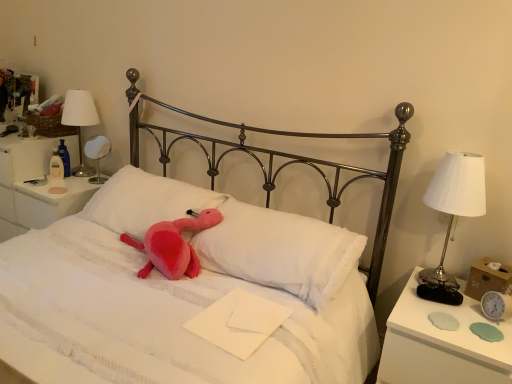
Question: Is silver metallic clock at right turned away from white soft pillow at center, the 2th pillow from the left?

Choices:
 (A) yes
 (B) no

Answer: (B)

Question: From a real-world perspective, is silver metallic clock at right on top of white soft pillow at center, acting as the first pillow starting from the right?

Choices:
 (A) no
 (B) yes

Answer: (A)

Question: Is silver metallic clock at right to the right of white soft pillow at center, the 2th pillow from the left, from the viewer's perspective?

Choices:
 (A) no
 (B) yes

Answer: (B)

Question: From a real-world perspective, is silver metallic clock at right below white soft pillow at center, the 2th pillow from the left?

Choices:
 (A) no
 (B) yes

Answer: (B)

Question: Considering the relative sizes of silver metallic clock at right and white soft pillow at center, acting as the first pillow starting from the right, in the image provided, is silver metallic clock at right wider than white soft pillow at center, acting as the first pillow starting from the right,?

Choices:
 (A) yes
 (B) no

Answer: (B)

Question: From a real-world perspective, is fluffy pink pillow at center, which is the 1th pillow from left to right, above or below pink plush toy at center?

Choices:
 (A) below
 (B) above

Answer: (B)

Question: Is fluffy pink pillow at center, the second pillow from the right, in front of or behind pink plush toy at center in the image?

Choices:
 (A) behind
 (B) front

Answer: (A)

Question: From the image's perspective, relative to pink plush toy at center, is fluffy pink pillow at center, the second pillow from the right, above or below?

Choices:
 (A) above
 (B) below

Answer: (A)

Question: Would you say fluffy pink pillow at center, the second pillow from the right, is to the left or to the right of pink plush toy at center in the picture?

Choices:
 (A) left
 (B) right

Answer: (A)

Question: Does point (196, 304) appear closer or farther from the camera than point (80, 168)?

Choices:
 (A) farther
 (B) closer

Answer: (B)

Question: In the image, is pink plush toy at center positioned in front of or behind white fabric lampshade at upper left, the 3th bedside lamp from the right?

Choices:
 (A) front
 (B) behind

Answer: (A)

Question: Based on their positions, is pink plush toy at center located to the left or right of white fabric lampshade at upper left, the 3th bedside lamp from the right?

Choices:
 (A) right
 (B) left

Answer: (A)

Question: From the image's perspective, is pink plush toy at center located above or below white fabric lampshade at upper left, the 2th bedside lamp in the back-to-front sequence?

Choices:
 (A) below
 (B) above

Answer: (A)

Question: From a real-world perspective, is matte silver mirror at left, the third bedside lamp when ordered from front to back, positioned above or below white soft pillow at center, the 2th pillow from the left?

Choices:
 (A) above
 (B) below

Answer: (A)

Question: Based on their sizes in the image, would you say matte silver mirror at left, which is the 2th bedside lamp from right to left, is bigger or smaller than white soft pillow at center, the 2th pillow from the left?

Choices:
 (A) big
 (B) small

Answer: (B)